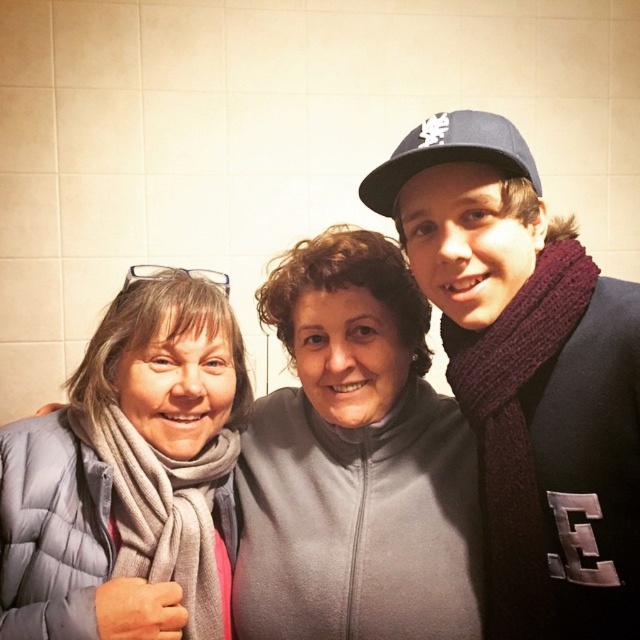
Which is below, gray quilted jacket at center or gray quilted jacket at left?

gray quilted jacket at left is below.

Based on the photo, does gray quilted jacket at center have a smaller size compared to gray quilted jacket at left?

Actually, gray quilted jacket at center might be larger than gray quilted jacket at left.

Where is `gray quilted jacket at center`? gray quilted jacket at center is located at coordinates (355, 461).

Between knitted dark red scarf at right and gray quilted jacket at left, which one has less height?

gray quilted jacket at left

From the picture: Does knitted dark red scarf at right appear over gray quilted jacket at left?

Correct, knitted dark red scarf at right is located above gray quilted jacket at left.

In order to click on knitted dark red scarf at right in this screenshot , I will do `click(529, 372)`.

I want to click on knitted dark red scarf at right, so click(x=529, y=372).

Is knitted dark red scarf at right wider than gray quilted jacket at center?

No, knitted dark red scarf at right is not wider than gray quilted jacket at center.

Can you confirm if knitted dark red scarf at right is thinner than gray quilted jacket at center?

Yes.

Does point (637, 518) come closer to viewer compared to point (362, 461)?

Yes.

The height and width of the screenshot is (640, 640). Find the location of `knitted dark red scarf at right`. knitted dark red scarf at right is located at coordinates click(529, 372).